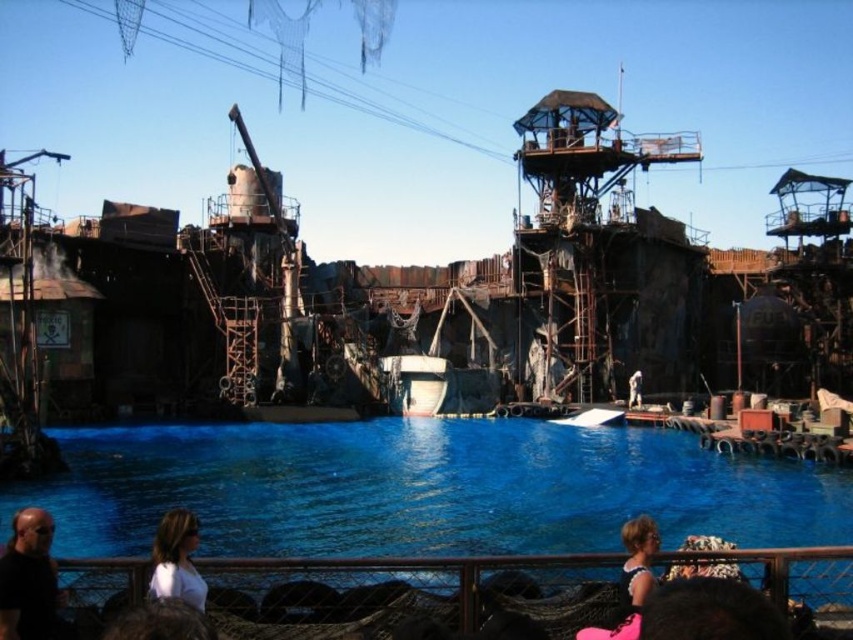
Who is shorter, blue liquid water at center or blonde hair at lower center?

With less height is blonde hair at lower center.

Does blue liquid water at center have a greater height compared to blonde hair at lower center?

Yes, blue liquid water at center is taller than blonde hair at lower center.

Is point (115, 484) closer to camera compared to point (634, 534)?

No, (115, 484) is behind (634, 534).

The height and width of the screenshot is (640, 853). I want to click on blue liquid water at center, so click(x=422, y=488).

Is dark hair at lower left above white matte shirt at lower left?

No.

From the picture: Measure the distance from dark hair at lower left to white matte shirt at lower left.

8.53 meters

Is point (18, 560) less distant than point (193, 547)?

Yes, it is in front of point (193, 547).

This screenshot has width=853, height=640. Find the location of `dark hair at lower left`. dark hair at lower left is located at coordinates (28, 579).

Can you confirm if blue liquid water at center is shorter than dark hair at lower left?

No.

Between blue liquid water at center and dark hair at lower left, which one appears on the right side from the viewer's perspective?

Positioned to the right is blue liquid water at center.

Is point (96, 484) more distant than point (1, 611)?

Yes, point (96, 484) is behind point (1, 611).

Where is `blue liquid water at center`? This screenshot has height=640, width=853. blue liquid water at center is located at coordinates (422, 488).